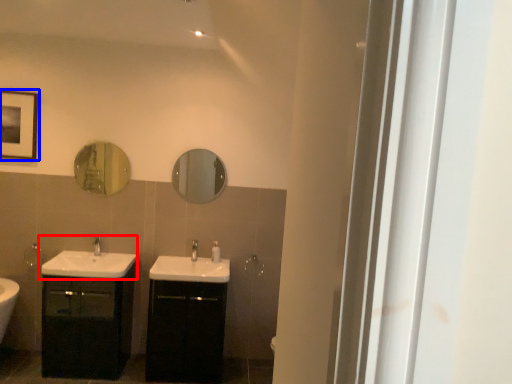
Question: Which object is further to the camera taking this photo, sink (highlighted by a red box) or picture frame (highlighted by a blue box)?

Choices:
 (A) sink
 (B) picture frame

Answer: (B)